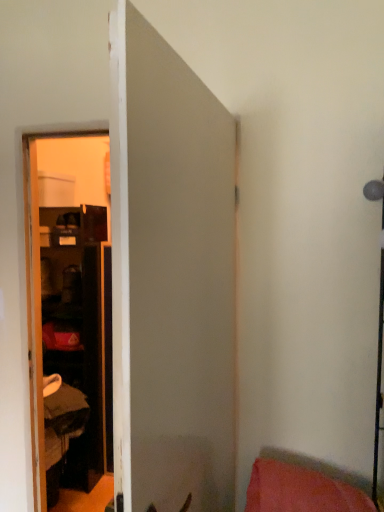
Question: Does pink fabric pillow at lower right have a smaller size compared to white matte door at center?

Choices:
 (A) yes
 (B) no

Answer: (A)

Question: Is pink fabric pillow at lower right not inside white matte door at center?

Choices:
 (A) yes
 (B) no

Answer: (A)

Question: Can you confirm if pink fabric pillow at lower right is taller than white matte door at center?

Choices:
 (A) yes
 (B) no

Answer: (B)

Question: Can you confirm if pink fabric pillow at lower right is thinner than white matte door at center?

Choices:
 (A) yes
 (B) no

Answer: (B)

Question: Does pink fabric pillow at lower right lie behind white matte door at center?

Choices:
 (A) no
 (B) yes

Answer: (B)

Question: From the image's perspective, is pink fabric pillow at lower right under white matte door at center?

Choices:
 (A) no
 (B) yes

Answer: (B)

Question: Is white matte door at center oriented towards pink fabric pillow at lower right?

Choices:
 (A) no
 (B) yes

Answer: (B)

Question: Is white matte door at center taller than pink fabric pillow at lower right?

Choices:
 (A) no
 (B) yes

Answer: (B)

Question: Is the surface of white matte door at center in direct contact with pink fabric pillow at lower right?

Choices:
 (A) no
 (B) yes

Answer: (A)

Question: Is white matte door at center not near pink fabric pillow at lower right?

Choices:
 (A) no
 (B) yes

Answer: (A)

Question: Can you confirm if white matte door at center is positioned to the left of pink fabric pillow at lower right?

Choices:
 (A) no
 (B) yes

Answer: (B)

Question: From a real-world perspective, is white matte door at center located beneath pink fabric pillow at lower right?

Choices:
 (A) no
 (B) yes

Answer: (A)

Question: Looking at their shapes, would you say pink fabric pillow at lower right is wider or thinner than white matte door at center?

Choices:
 (A) thin
 (B) wide

Answer: (B)